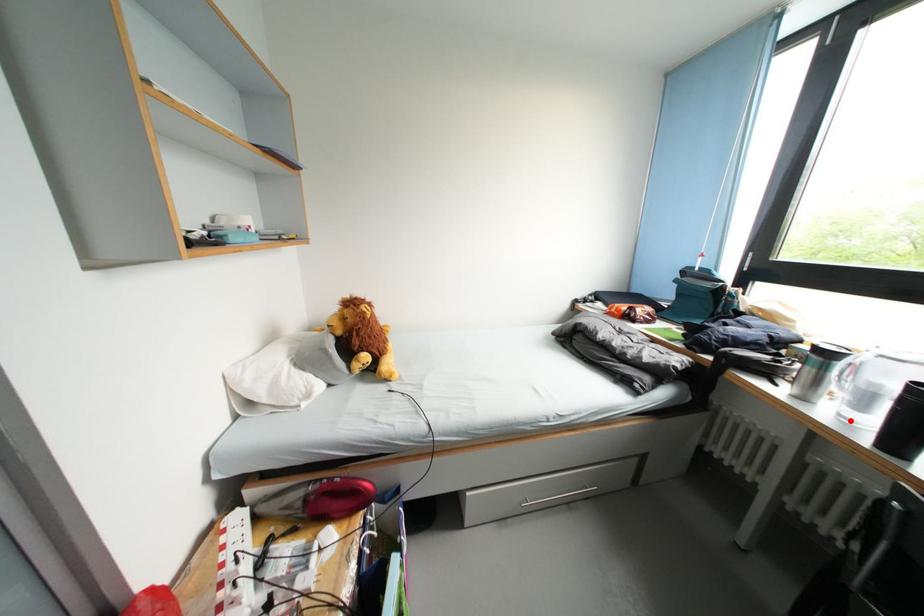
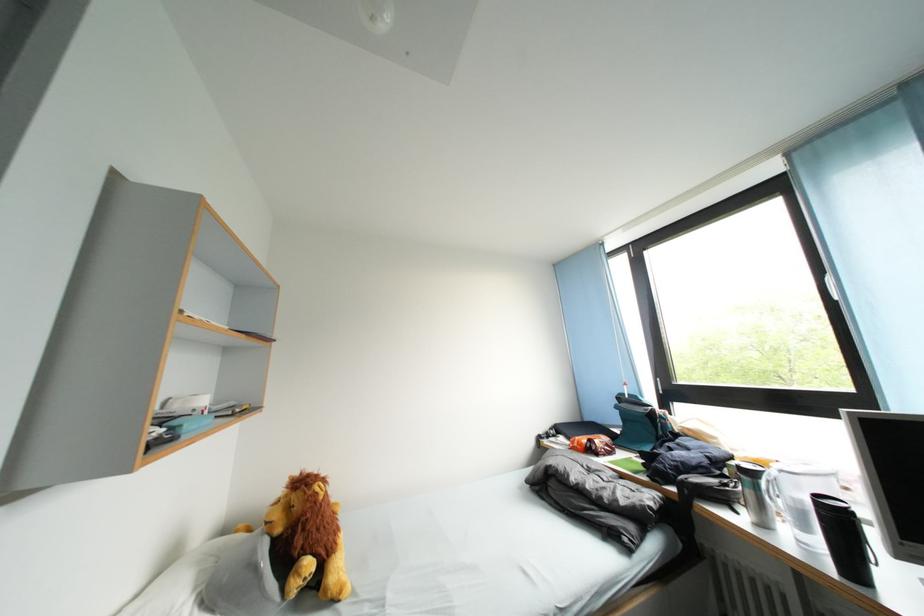
Question: I am providing you with two images of the same scene from different viewpoints. A red point is marked on the first image. At the location where the point appears in image 1, is it still visible in image 2?

Choices:
 (A) Yes
 (B) No

Answer: (A)